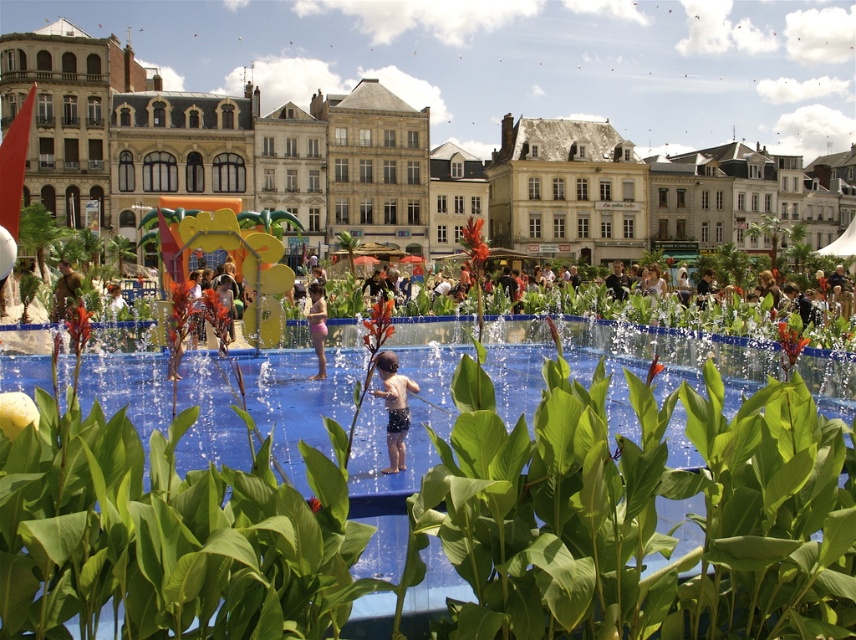
You are a photographer trying to capture a photo of the blue rubber pool at center and the camouflage fabric person at center. Since you want both subjects to be clearly visible, which one should you zoom in on more to ensure they are both in focus?

The blue rubber pool at center is larger in size than camouflage fabric person at center, so you should zoom in more on the camouflage fabric person at center to ensure both are in focus.

You are a park visitor who needs to place a large picnic blanket between the matte orange playground at center and the pink fabric at center. The picnic blanket requires 40 meters of space. Can you fit it between them?

The distance between the matte orange playground at center and the pink fabric at center is 37.27 meters, which is less than the required 40 meters. Therefore, the picnic blanket cannot be placed between them.

You are a photographer standing in the park and want to take a photo of the blue swim trunks at center and the pink fabric at center. Which object should you focus on first to ensure both are in focus?

You should focus on the blue swim trunks at center first because it is closer to the viewer than the pink fabric at center, so adjusting focus from near to far will help both be in focus.